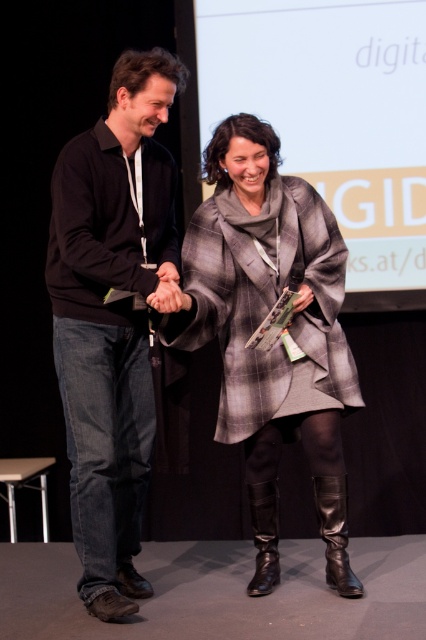
Can you confirm if black matte sweater at center is positioned to the left of plaid wool coat at center?

Correct, you'll find black matte sweater at center to the left of plaid wool coat at center.

Which is in front, point (173, 164) or point (258, 321)?

Positioned in front is point (258, 321).

This screenshot has width=426, height=640. Find the location of `black matte sweater at center`. black matte sweater at center is located at coordinates (112, 316).

Locate an element on the screen. This screenshot has height=640, width=426. black matte sweater at center is located at coordinates (112, 316).

Is black matte sweater at center further to camera compared to black leather boot at lower right?

That is False.

Is point (144, 412) in front of point (345, 582)?

That is False.

At what (x,y) coordinates should I click in order to perform the action: click on black matte sweater at center. Please return your answer as a coordinate pair (x, y). Looking at the image, I should click on (x=112, y=316).

Is black leather boot at lower right shorter than black leather boot at lower center?

No.

Does point (328, 499) lie behind point (271, 522)?

No, (328, 499) is in front of (271, 522).

Is point (339, 515) farther from viewer compared to point (273, 508)?

No, it is in front of (273, 508).

The width and height of the screenshot is (426, 640). I want to click on black leather boot at lower right, so click(334, 532).